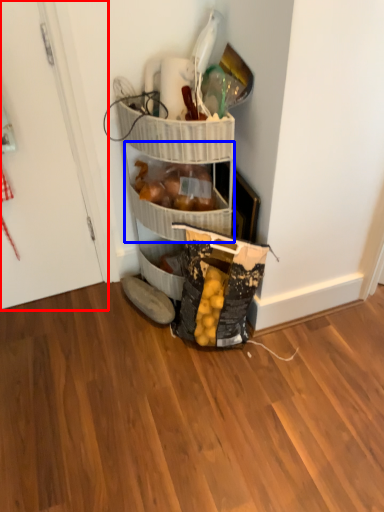
Question: Among these objects, which one is farthest to the camera, door (highlighted by a red box) or basket (highlighted by a blue box)?

Choices:
 (A) door
 (B) basket

Answer: (B)